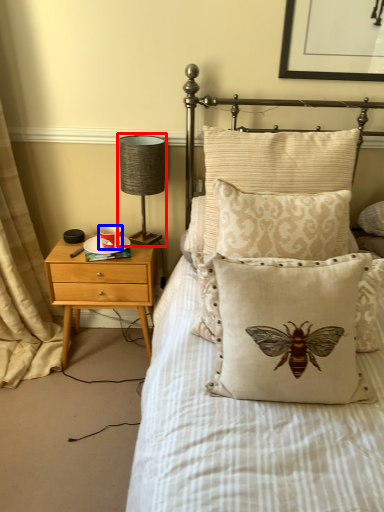
Question: Which object appears farthest to the camera in this image, table lamp (highlighted by a red box) or coffee cup (highlighted by a blue box)?

Choices:
 (A) table lamp
 (B) coffee cup

Answer: (B)